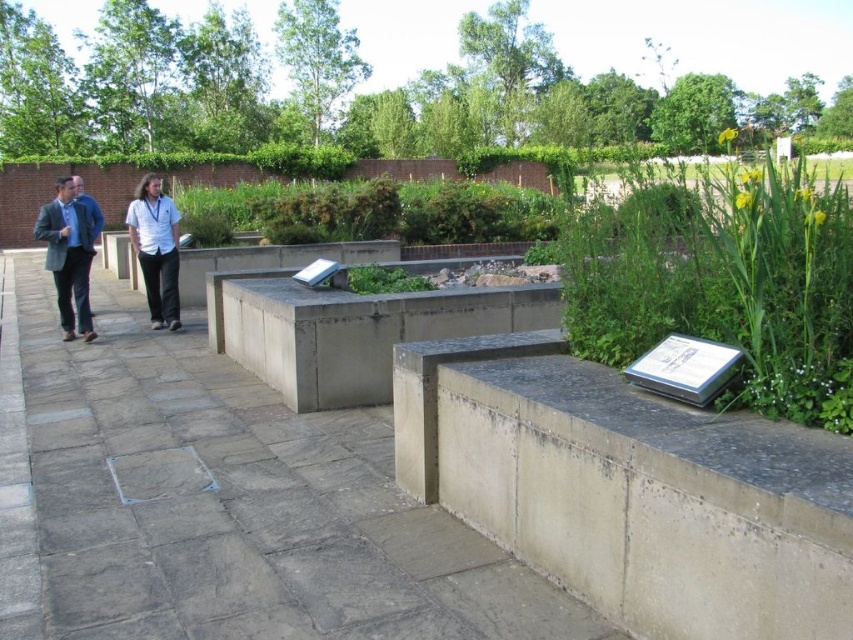
Between matte black suit at left and green leafy plant at center, which one is positioned lower?

matte black suit at left

Is point (90, 253) positioned after point (396, 284)?

That is True.

Where is `matte black suit at left`? This screenshot has height=640, width=853. matte black suit at left is located at coordinates (68, 257).

Does gray stone path at center have a larger size compared to white shirt at center?

Actually, gray stone path at center might be smaller than white shirt at center.

Between gray stone path at center and white shirt at center, which one appears on the left side from the viewer's perspective?

white shirt at center is more to the left.

The image size is (853, 640). I want to click on gray stone path at center, so click(219, 500).

Which is behind, point (322, 598) or point (346, 269)?

Point (346, 269)

The height and width of the screenshot is (640, 853). What do you see at coordinates (219, 500) in the screenshot?
I see `gray stone path at center` at bounding box center [219, 500].

What are the coordinates of `gray stone path at center` in the screenshot? It's located at (219, 500).